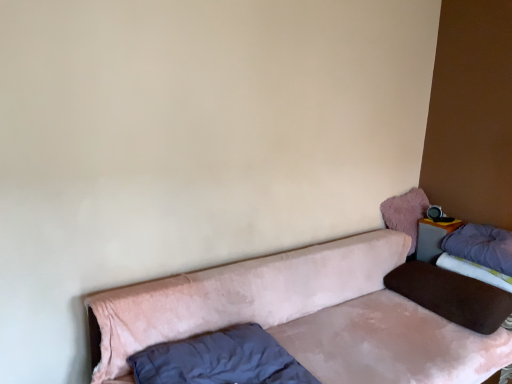
Question: Is point (474, 251) closer or farther from the camera than point (489, 274)?

Choices:
 (A) farther
 (B) closer

Answer: (A)

Question: Is purple soft pillow at upper right, the first pillow from the right, inside or outside of velvet purple mattress at right?

Choices:
 (A) inside
 (B) outside

Answer: (B)

Question: Which is nearer to the velvet purple mattress at right?

Choices:
 (A) matte gray table at upper right
 (B) purple soft pillow at upper right, the fourth pillow positioned from the left
 (C) velvet pink pillow at upper right, positioned as the 3th pillow in right-to-left order
 (D) velvet dark blue pillow at lower left, the fourth pillow in the right-to-left sequence
 (E) brown velvety pillow at right, the 3th pillow positioned from the left

Answer: (B)

Question: Which object is positioned closest to the velvet purple mattress at right?

Choices:
 (A) purple soft pillow at upper right, the first pillow from the right
 (B) velvet dark blue pillow at lower left, the 1th pillow viewed from the left
 (C) velvet pink couch at lower center
 (D) brown velvety pillow at right, the 3th pillow positioned from the left
 (E) velvet pink pillow at upper right, positioned as the 3th pillow in right-to-left order

Answer: (A)